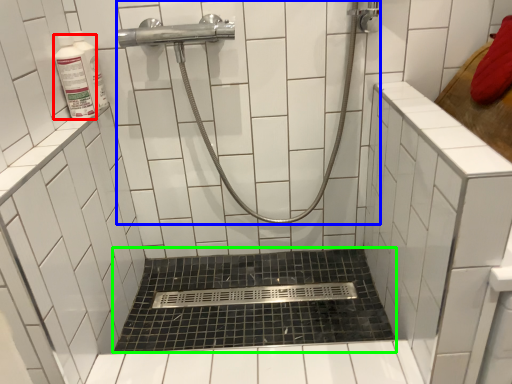
Question: Estimate the real-world distances between objects in this image. Which object is closer to toiletry (highlighted by a red box), shower (highlighted by a blue box) or bath (highlighted by a green box)?

Choices:
 (A) shower
 (B) bath

Answer: (A)